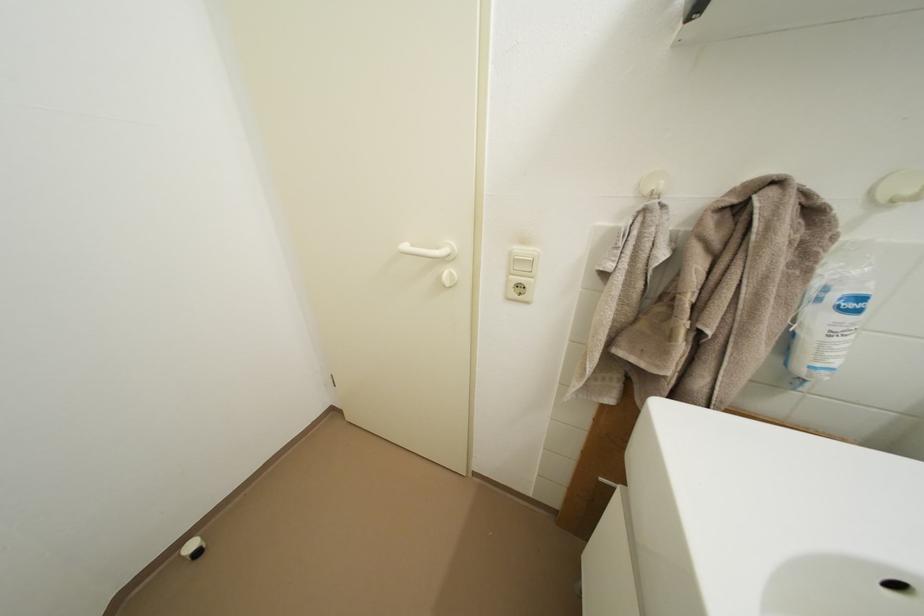
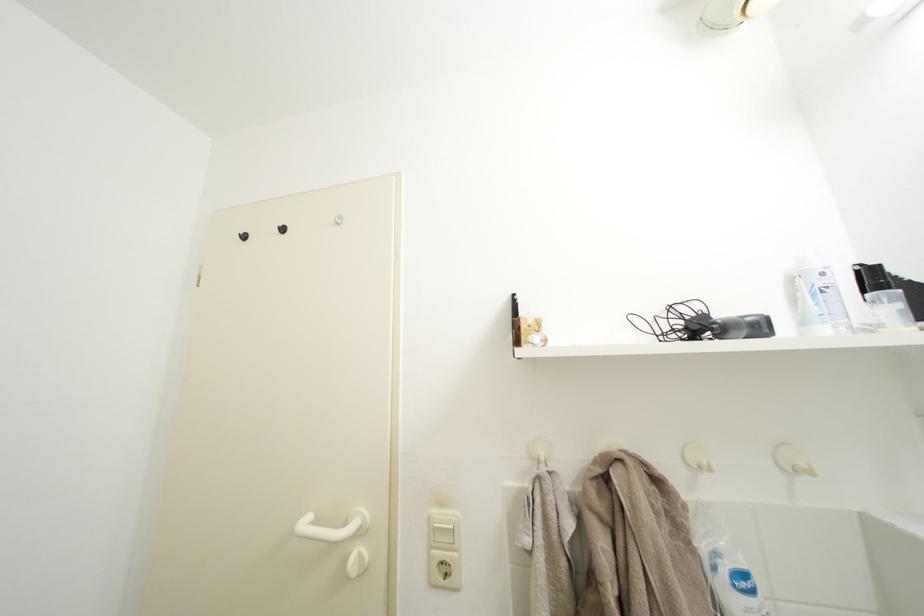
In the second image, find the point that corresponds to (415,253) in the first image.

(314, 528)